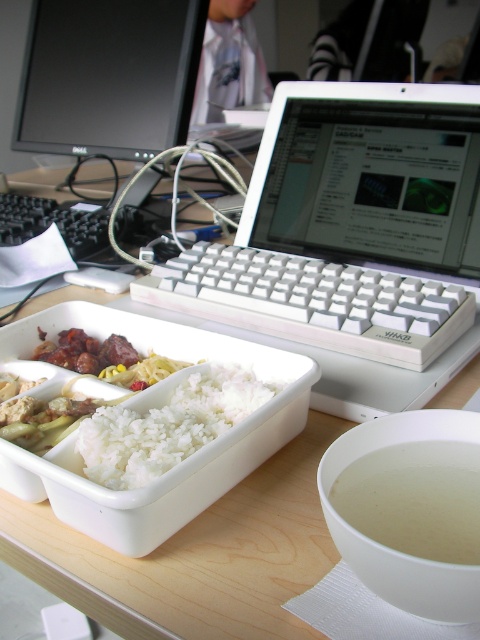
Who is higher up, white plastic laptop at center or black glossy monitor at upper left?

black glossy monitor at upper left is higher up.

Between white plastic laptop at center and black glossy monitor at upper left, which one has more height?

Standing taller between the two is white plastic laptop at center.

Is point (416, 384) positioned before point (22, 93)?

Yes, it is in front of point (22, 93).

Find the location of `white plastic laptop at center`. white plastic laptop at center is located at coordinates (348, 241).

Who is shorter, white plastic laptop at center or translucent white soup at lower right?

translucent white soup at lower right is shorter.

Who is more distant from viewer, (317, 381) or (453, 497)?

Positioned behind is point (317, 381).

Locate an element on the screen. Image resolution: width=480 pixels, height=640 pixels. white plastic laptop at center is located at coordinates [x=348, y=241].

Is point (146, 144) in front of point (207, 436)?

No, it is not.

Based on the photo, who is more forward, (32, 99) or (190, 401)?

Point (190, 401)

Who is more distant from viewer, (96, 76) or (99, 429)?

The point (96, 76) is behind.

In order to click on black glossy monitor at upper left in this screenshot , I will do `click(108, 76)`.